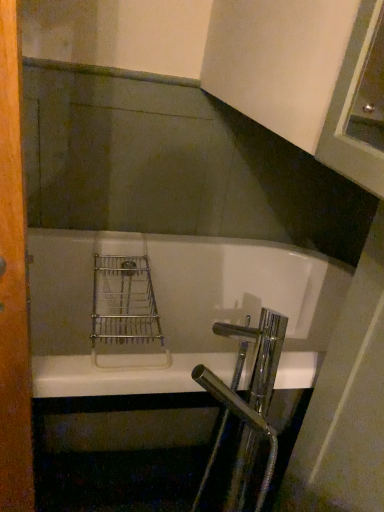
What is the approximate width of wooden screen door at left?

It is 8.80 centimeters.

Locate an element on the screen. The height and width of the screenshot is (512, 384). wooden screen door at left is located at coordinates (13, 281).

What do you see at coordinates (13, 281) in the screenshot? I see `wooden screen door at left` at bounding box center [13, 281].

This screenshot has width=384, height=512. What do you see at coordinates (174, 310) in the screenshot?
I see `white glossy bathtub at center` at bounding box center [174, 310].

Where is `white glossy bathtub at center`? Image resolution: width=384 pixels, height=512 pixels. white glossy bathtub at center is located at coordinates (174, 310).

What is the approximate width of white glossy bathtub at center?

The width of white glossy bathtub at center is 32.66 inches.

This screenshot has height=512, width=384. In order to click on wooden screen door at left in this screenshot , I will do `click(13, 281)`.

Does white glossy bathtub at center appear on the right side of wooden screen door at left?

Correct, you'll find white glossy bathtub at center to the right of wooden screen door at left.

Is white glossy bathtub at center closer to camera compared to wooden screen door at left?

No, white glossy bathtub at center is behind wooden screen door at left.

Does point (301, 261) appear closer or farther from the camera than point (8, 150)?

Point (301, 261) is farther from the camera than point (8, 150).

From the image's perspective, which is above, white glossy bathtub at center or wooden screen door at left?

wooden screen door at left is shown above in the image.

From a real-world perspective, is white glossy bathtub at center under wooden screen door at left?

Indeed, from a real-world perspective, white glossy bathtub at center is positioned beneath wooden screen door at left.

Can you confirm if white glossy bathtub at center is thinner than wooden screen door at left?

Incorrect, the width of white glossy bathtub at center is not less than that of wooden screen door at left.

Which of these two, white glossy bathtub at center or wooden screen door at left, stands shorter?

With less height is white glossy bathtub at center.

Looking at this image, is white glossy bathtub at center bigger or smaller than wooden screen door at left?

Clearly, white glossy bathtub at center is larger in size than wooden screen door at left.

Which is correct: white glossy bathtub at center is inside wooden screen door at left, or outside of it?

white glossy bathtub at center is not inside wooden screen door at left, it's outside.

Is the surface of white glossy bathtub at center in direct contact with wooden screen door at left?

No.

Could you tell me if white glossy bathtub at center is facing wooden screen door at left?

No, white glossy bathtub at center is not turned towards wooden screen door at left.

Find the location of `bathtub lying on the right of wooden screen door at left`. bathtub lying on the right of wooden screen door at left is located at coordinates (174, 310).

Considering the relative positions of wooden screen door at left and white glossy bathtub at center in the image provided, is wooden screen door at left to the left of white glossy bathtub at center from the viewer's perspective?

Yes, wooden screen door at left is to the left of white glossy bathtub at center.

Is wooden screen door at left in front of white glossy bathtub at center?

Yes.

Is point (22, 357) closer or farther from the camera than point (259, 268)?

Point (22, 357) is closer to the camera than point (259, 268).

From the image's perspective, which one is positioned lower, wooden screen door at left or white glossy bathtub at center?

From the image's view, white glossy bathtub at center is below.

From a real-world perspective, which is physically above, wooden screen door at left or white glossy bathtub at center?

From a 3D spatial view, wooden screen door at left is above.

Considering the sizes of wooden screen door at left and white glossy bathtub at center in the image, is wooden screen door at left wider or thinner than white glossy bathtub at center?

Clearly, wooden screen door at left has less width compared to white glossy bathtub at center.

Considering the sizes of objects wooden screen door at left and white glossy bathtub at center in the image provided, who is shorter, wooden screen door at left or white glossy bathtub at center?

Standing shorter between the two is white glossy bathtub at center.

Considering the sizes of objects wooden screen door at left and white glossy bathtub at center in the image provided, who is smaller, wooden screen door at left or white glossy bathtub at center?

wooden screen door at left is smaller.

Can we say wooden screen door at left lies outside white glossy bathtub at center?

wooden screen door at left is positioned outside white glossy bathtub at center.

Is wooden screen door at left next to white glossy bathtub at center?

They are not placed beside each other.

Is white glossy bathtub at center at the back of wooden screen door at left?

wooden screen door at left is not turned away from white glossy bathtub at center.

What's the angular difference between wooden screen door at left and white glossy bathtub at center's facing directions?

The facing directions of wooden screen door at left and white glossy bathtub at center are 0.493 degrees apart.

Measure the distance from wooden screen door at left to white glossy bathtub at center.

wooden screen door at left is 32.51 inches from white glossy bathtub at center.

Locate an element on the screen. The height and width of the screenshot is (512, 384). screen door in front of the white glossy bathtub at center is located at coordinates (13, 281).

You are a GUI agent. You are given a task and a screenshot of the screen. Output one action in this format:
    pyautogui.click(x=<x>, y=<y>)
    Task: Click on the bathtub located on the right of wooden screen door at left
    The image size is (384, 512).
    Given the screenshot: What is the action you would take?
    (174, 310)

In the image, there is a white glossy bathtub at center. Find the location of `screen door above it (from the image's perspective)`. screen door above it (from the image's perspective) is located at coordinates point(13,281).